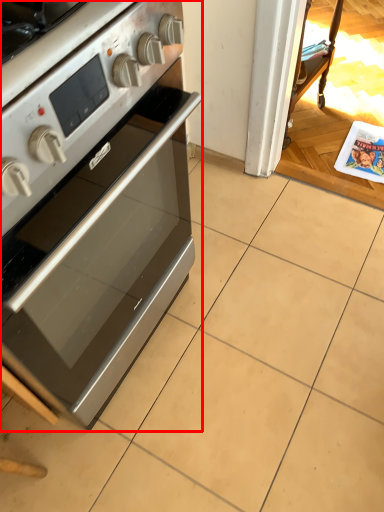
Question: From the image's perspective, where is home appliance (annotated by the red box) located relative to magazine?

Choices:
 (A) above
 (B) below

Answer: (B)